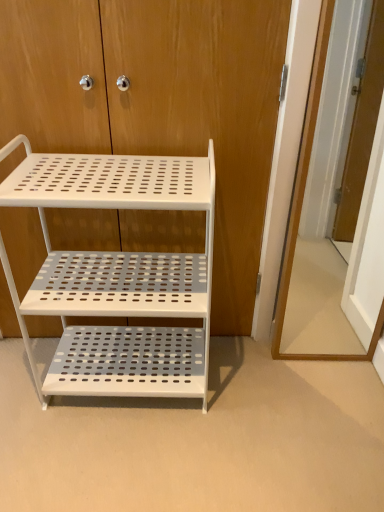
Identify the location of free space to the left of wooden door at right. The height and width of the screenshot is (512, 384). (261, 370).